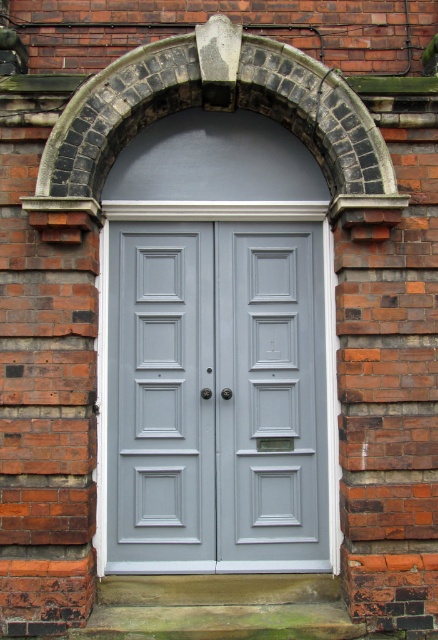
Is satin gray door at center wider than dark gray stone arch at center?

No, satin gray door at center is not wider than dark gray stone arch at center.

Can you confirm if satin gray door at center is positioned above dark gray stone arch at center?

Actually, satin gray door at center is below dark gray stone arch at center.

The image size is (438, 640). What do you see at coordinates (216, 396) in the screenshot?
I see `satin gray door at center` at bounding box center [216, 396].

This screenshot has width=438, height=640. I want to click on satin gray door at center, so click(x=216, y=396).